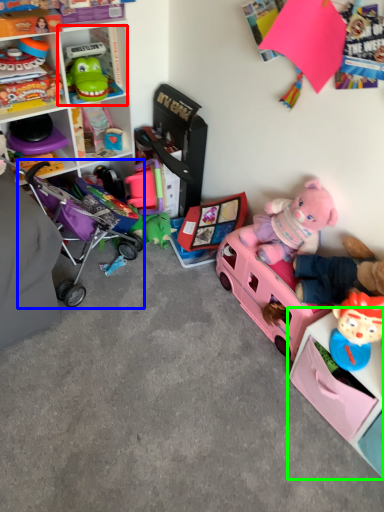
Question: Considering the real-world distances, which object is closest to cabinet (highlighted by a red box)? baby carriage (highlighted by a blue box) or shelf (highlighted by a green box).

Choices:
 (A) baby carriage
 (B) shelf

Answer: (A)